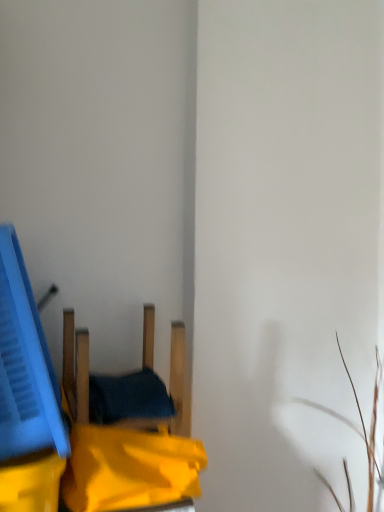
Question: Considering the relative sizes of wooden chair at center and blue plastic crate at left in the image provided, is wooden chair at center thinner than blue plastic crate at left?

Choices:
 (A) yes
 (B) no

Answer: (A)

Question: Can you confirm if wooden chair at center is wider than blue plastic crate at left?

Choices:
 (A) yes
 (B) no

Answer: (B)

Question: Is wooden chair at center to the left of blue plastic crate at left from the viewer's perspective?

Choices:
 (A) yes
 (B) no

Answer: (B)

Question: Does wooden chair at center have a greater height compared to blue plastic crate at left?

Choices:
 (A) no
 (B) yes

Answer: (A)

Question: Can you confirm if wooden chair at center is shorter than blue plastic crate at left?

Choices:
 (A) yes
 (B) no

Answer: (A)

Question: Could blue plastic crate at left be considered to be inside wooden chair at center?

Choices:
 (A) no
 (B) yes

Answer: (A)

Question: Does blue plastic crate at left appear on the right side of wooden chair at center?

Choices:
 (A) no
 (B) yes

Answer: (A)

Question: Is blue plastic crate at left at the left side of wooden chair at center?

Choices:
 (A) no
 (B) yes

Answer: (B)

Question: Can you confirm if blue plastic crate at left is shorter than wooden chair at center?

Choices:
 (A) no
 (B) yes

Answer: (A)

Question: Is blue plastic crate at left positioned with its back to wooden chair at center?

Choices:
 (A) yes
 (B) no

Answer: (B)

Question: From the image's perspective, does blue plastic crate at left appear higher than wooden chair at center?

Choices:
 (A) no
 (B) yes

Answer: (B)

Question: Would you say blue plastic crate at left is a long distance from wooden chair at center?

Choices:
 (A) no
 (B) yes

Answer: (A)

Question: Would you say blue plastic crate at left is to the left or to the right of wooden chair at center in the picture?

Choices:
 (A) right
 (B) left

Answer: (B)